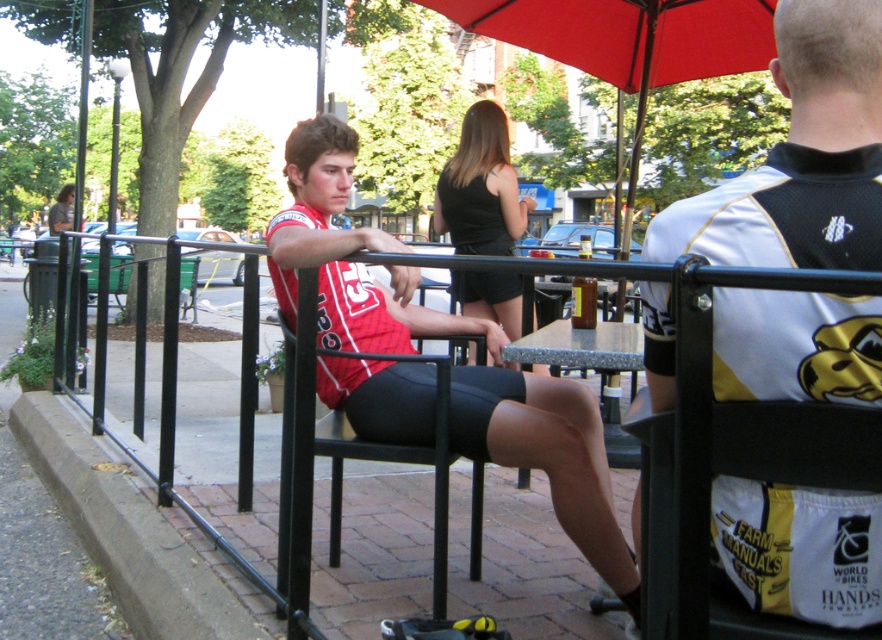
Question: Which point appears closest to the camera in this image?

Choices:
 (A) (632, 611)
 (B) (468, 284)
 (C) (486, 24)
 (D) (69, 205)

Answer: (A)

Question: Can you confirm if white mesh shirt at center is bigger than metallic gray table at center?

Choices:
 (A) yes
 (B) no

Answer: (B)

Question: Does black metal fence at left come in front of black metal chair at center?

Choices:
 (A) no
 (B) yes

Answer: (B)

Question: Among these objects, which one is nearest to the camera?

Choices:
 (A) red fabric umbrella at upper center
 (B) matte red jersey at center
 (C) white mesh shirt at center

Answer: (C)

Question: Which is nearer to the black metal fence at left?

Choices:
 (A) metallic gray table at center
 (B) black matte dress at center
 (C) matte black shirt at upper left

Answer: (A)

Question: Is white mesh shirt at center above black metal fence at left?

Choices:
 (A) yes
 (B) no

Answer: (A)